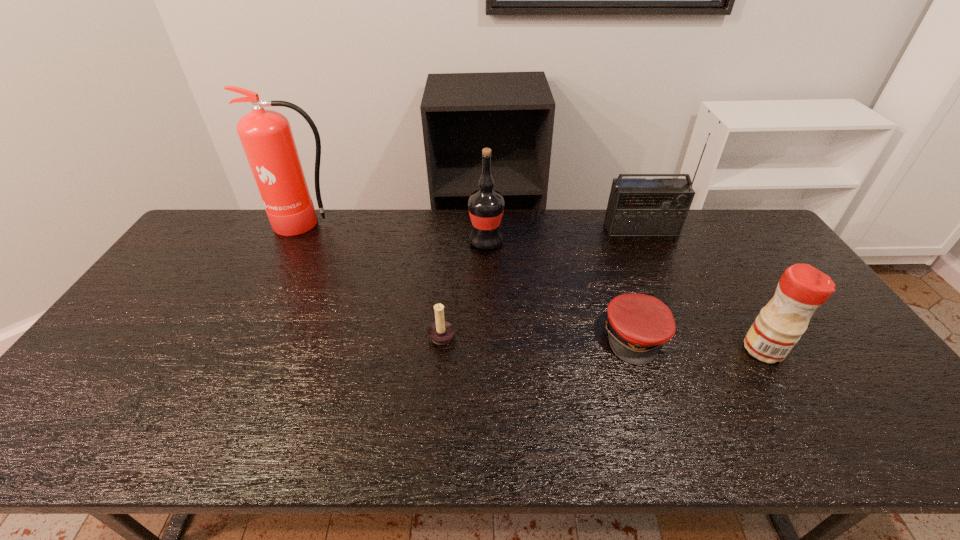
At what (x,y) coordinates should I click in order to perform the action: click on vacant region located on the back of the wine bottle. Please return your answer as a coordinate pair (x, y). This screenshot has width=960, height=540. Looking at the image, I should click on (486, 212).

Identify the location of vacant space located 0.320m on the left of the fourth tallest object. The height and width of the screenshot is (540, 960). (622, 349).

You are a GUI agent. You are given a task and a screenshot of the screen. Output one action in this format:
    pyautogui.click(x=<x>, y=<y>)
    Task: Click on the free space located on the wick of the candle holder
    The height and width of the screenshot is (540, 960).
    Given the screenshot: What is the action you would take?
    pyautogui.click(x=517, y=334)

This screenshot has height=540, width=960. Identify the location of vacant space positioned on the front of the shortest object with an emblem. (660, 411).

I want to click on fire extinguisher at the far edge, so click(x=266, y=136).

Where is `radio receiver at the far edge`? The height and width of the screenshot is (540, 960). radio receiver at the far edge is located at coordinates (637, 206).

Locate an element on the screen. wine bottle located in the far edge section of the desktop is located at coordinates (486, 206).

Find the location of a particular element. The width and height of the screenshot is (960, 540). free space at the far edge of the desktop is located at coordinates (639, 239).

In the image, there is a desktop. What are the coordinates of `free region at the near edge` in the screenshot? It's located at (276, 444).

The height and width of the screenshot is (540, 960). I want to click on blank space at the left edge of the desktop, so click(229, 252).